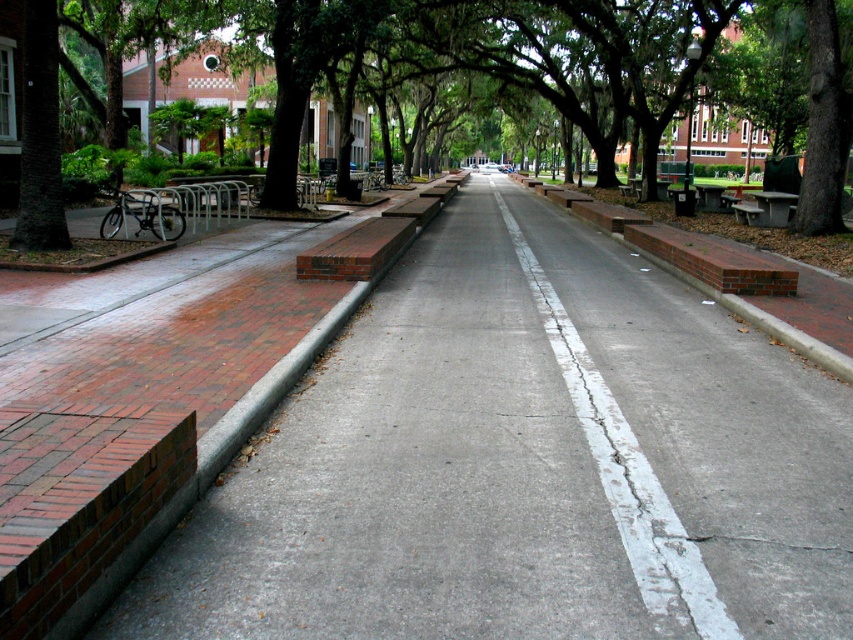
Can you confirm if gray concrete pavement at left is shorter than white cracked concrete at center?

Indeed, gray concrete pavement at left has a lesser height compared to white cracked concrete at center.

Who is more distant from viewer, (239, 465) or (538, 298)?

The point (538, 298) is more distant.

At what (x,y) coordinates should I click in order to perform the action: click on gray concrete pavement at left. Please return your answer as a coordinate pair (x, y). Looking at the image, I should click on (524, 461).

Based on the photo, can you confirm if green leafy tree at center is thinner than gray concrete bench at center?

In fact, green leafy tree at center might be wider than gray concrete bench at center.

Who is taller, green leafy tree at center or gray concrete bench at center?

Standing taller between the two is green leafy tree at center.

Between point (277, 68) and point (750, 221), which one is positioned in front?

Point (277, 68) is more forward.

At what (x,y) coordinates should I click in order to perform the action: click on green leafy tree at center. Please return your answer as a coordinate pair (x, y). Looking at the image, I should click on (602, 58).

Who is taller, gray concrete pavement at left or green leafy tree at center?

With more height is green leafy tree at center.

Is gray concrete pavement at left closer to the viewer compared to green leafy tree at center?

Yes, it is.

Between point (526, 355) and point (547, 54), which one is positioned behind?

The point (547, 54) is behind.

You are a GUI agent. You are given a task and a screenshot of the screen. Output one action in this format:
    pyautogui.click(x=<x>, y=<y>)
    Task: Click on the gray concrete pavement at left
    The width and height of the screenshot is (853, 640).
    Given the screenshot: What is the action you would take?
    pyautogui.click(x=524, y=461)